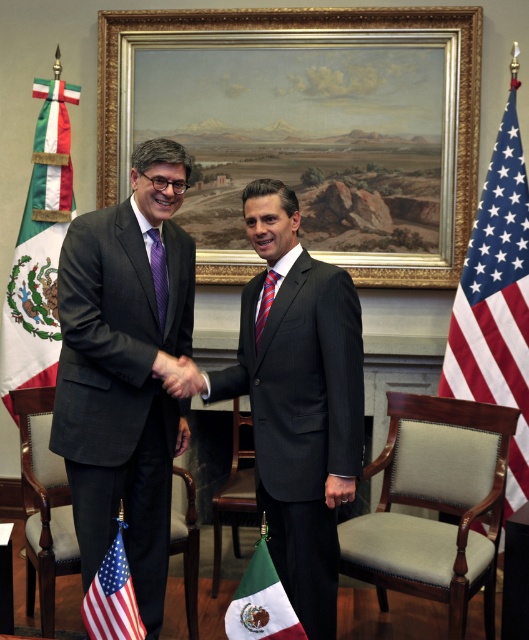
Does gold-framed painting at center have a lesser height compared to smooth skin handshake at center?

No.

What do you see at coordinates (305, 129) in the screenshot? Image resolution: width=529 pixels, height=640 pixels. I see `gold-framed painting at center` at bounding box center [305, 129].

Who is more distant from viewer, (437, 248) or (163, 352)?

Point (437, 248)

The image size is (529, 640). In order to click on gold-framed painting at center in this screenshot , I will do `click(305, 129)`.

Which is in front, point (31, 200) or point (235, 612)?

Point (235, 612) is more forward.

Is white fabric flag at left thinner than green and white fabric flag at lower center?

Incorrect, white fabric flag at left's width is not less than green and white fabric flag at lower center's.

Between point (75, 96) and point (276, 628), which one is positioned behind?

The point (75, 96) is behind.

Find the location of a particular element. This screenshot has height=640, width=529. white fabric flag at left is located at coordinates pyautogui.click(x=40, y=250).

From the picture: Can you confirm if green and white fabric flag at lower center is positioned to the right of purple striped tie at center?

Indeed, green and white fabric flag at lower center is positioned on the right side of purple striped tie at center.

Can you confirm if green and white fabric flag at lower center is shorter than purple striped tie at center?

Correct, green and white fabric flag at lower center is not as tall as purple striped tie at center.

Between point (271, 563) and point (154, 285), which one is positioned behind?

The point (154, 285) is more distant.

Locate an element on the screen. The width and height of the screenshot is (529, 640). green and white fabric flag at lower center is located at coordinates (261, 602).